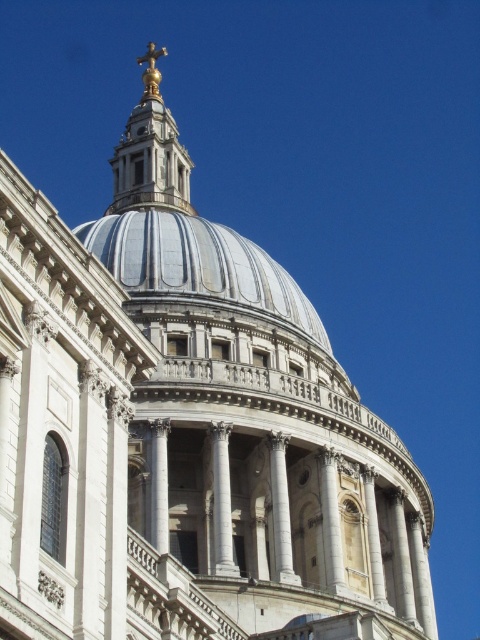
You are a tourist standing in front of St. Paul Cathedral. You see the white marble dome at center and the gold metallic cross at top. Which object is higher in the sky?

The gold metallic cross at top is higher in the sky than the white marble dome at center because the white marble dome at center is located below gold metallic cross at top.

You are a tourist standing in front of St. Paul Cathedral. You see the white marble dome at center and the gold metallic cross at top. Which object is taller?

The gold metallic cross at top is taller than the white marble dome at center.

You are standing in front of St. Paul Cathedral and looking at its dome. There are two points marked on the dome. One is at coordinate point (x=219, y=284) and the other at point (x=172, y=161). From your perspective, which point is closer to you?

Point (x=219, y=284) is in front of point (x=172, y=161), so it is closer to you.